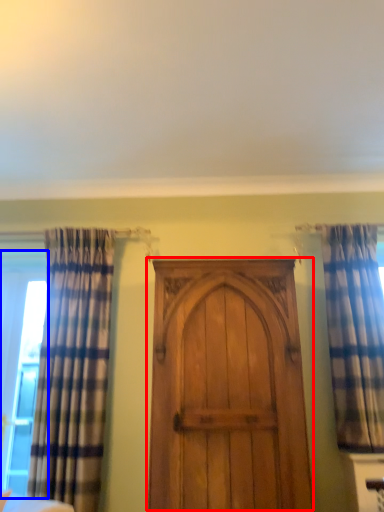
Question: Among these objects, which one is nearest to the camera, door (highlighted by a red box) or window (highlighted by a blue box)?

Choices:
 (A) door
 (B) window

Answer: (A)